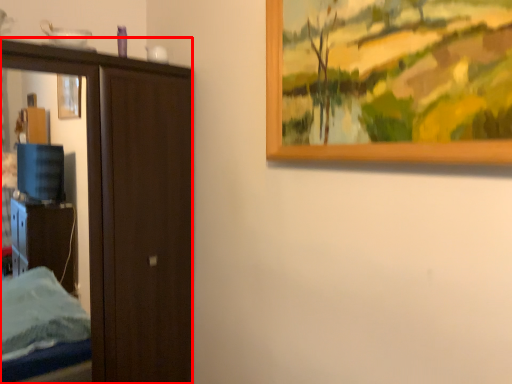
Question: Considering the relative positions of door (annotated by the red box) and picture frame in the image provided, where is door (annotated by the red box) located with respect to the staircase?

Choices:
 (A) left
 (B) right

Answer: (A)